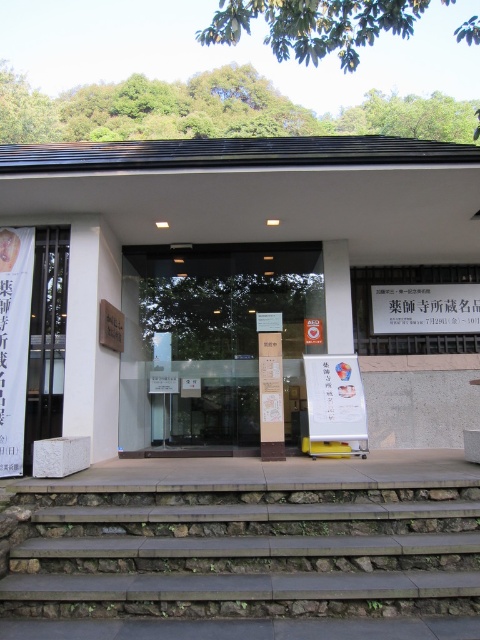
Question: Based on their relative distances, which object is nearer to the transparent glass door at center?

Choices:
 (A) brown stone stairs at lower center
 (B) white paper sign at upper right
 (C) metallic gate at left

Answer: (C)

Question: Observing the image, what is the correct spatial positioning of transparent glass door at center in reference to metallic gate at left?

Choices:
 (A) left
 (B) right

Answer: (B)

Question: Based on their relative distances, which object is nearer to the metallic gate at left?

Choices:
 (A) transparent glass door at center
 (B) white paper sign at upper right

Answer: (A)

Question: Can you confirm if metallic gate at left is positioned to the right of white paper sign at upper right?

Choices:
 (A) yes
 (B) no

Answer: (B)

Question: Which point is closer to the camera?

Choices:
 (A) transparent glass door at center
 (B) white paper sign at upper right

Answer: (A)

Question: Does transparent glass door at center have a larger size compared to metallic gate at left?

Choices:
 (A) yes
 (B) no

Answer: (A)